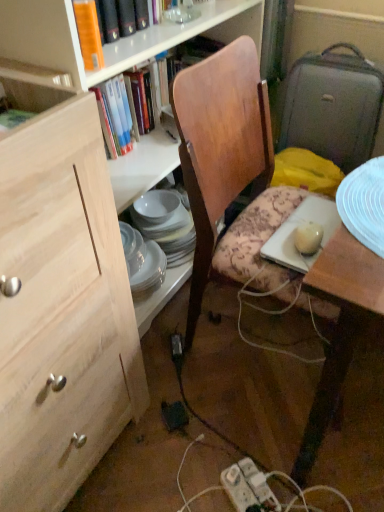
Question: Should I look upward or downward to see orange matte book at upper left, acting as the 2th book starting from the top?

Choices:
 (A) down
 (B) up

Answer: (B)

Question: Does orange hardcover book at upper left, the 3th book when ordered from front to back, have a greater height compared to wooden chair at center?

Choices:
 (A) no
 (B) yes

Answer: (A)

Question: From the image's perspective, does orange hardcover book at upper left, the 1th book from the top, appear lower than wooden chair at center?

Choices:
 (A) no
 (B) yes

Answer: (A)

Question: From a real-world perspective, does orange hardcover book at upper left, which ranks as the 1th book in back-to-front order, sit lower than wooden chair at center?

Choices:
 (A) yes
 (B) no

Answer: (B)

Question: Can you confirm if orange hardcover book at upper left, which ranks as the 1th book in back-to-front order, is wider than wooden chair at center?

Choices:
 (A) no
 (B) yes

Answer: (A)

Question: Is wooden chair at center inside orange hardcover book at upper left, marked as the third book in a bottom-to-top arrangement?

Choices:
 (A) no
 (B) yes

Answer: (A)

Question: Would you consider orange hardcover book at upper left, marked as the third book in a bottom-to-top arrangement, to be distant from wooden chair at center?

Choices:
 (A) no
 (B) yes

Answer: (A)

Question: From the image's perspective, is green matte book at upper left, which is counted as the first book, starting from the front, located above wooden desk at right?

Choices:
 (A) no
 (B) yes

Answer: (B)

Question: Is green matte book at upper left, which is the third book from back to front, aimed at wooden desk at right?

Choices:
 (A) no
 (B) yes

Answer: (A)

Question: Does green matte book at upper left, which is the third book from back to front, come in front of wooden desk at right?

Choices:
 (A) no
 (B) yes

Answer: (A)

Question: From a real-world perspective, is green matte book at upper left, which is the 3th book from top to bottom, over wooden desk at right?

Choices:
 (A) yes
 (B) no

Answer: (A)

Question: From the image's perspective, does green matte book at upper left, which is the first book in bottom-to-top order, appear lower than wooden desk at right?

Choices:
 (A) yes
 (B) no

Answer: (B)

Question: Is wooden desk at right at the back of green matte book at upper left, which is the first book in bottom-to-top order?

Choices:
 (A) yes
 (B) no

Answer: (B)

Question: From a real-world perspective, is wooden chair at center physically above natural wood cabinet at left?

Choices:
 (A) yes
 (B) no

Answer: (B)